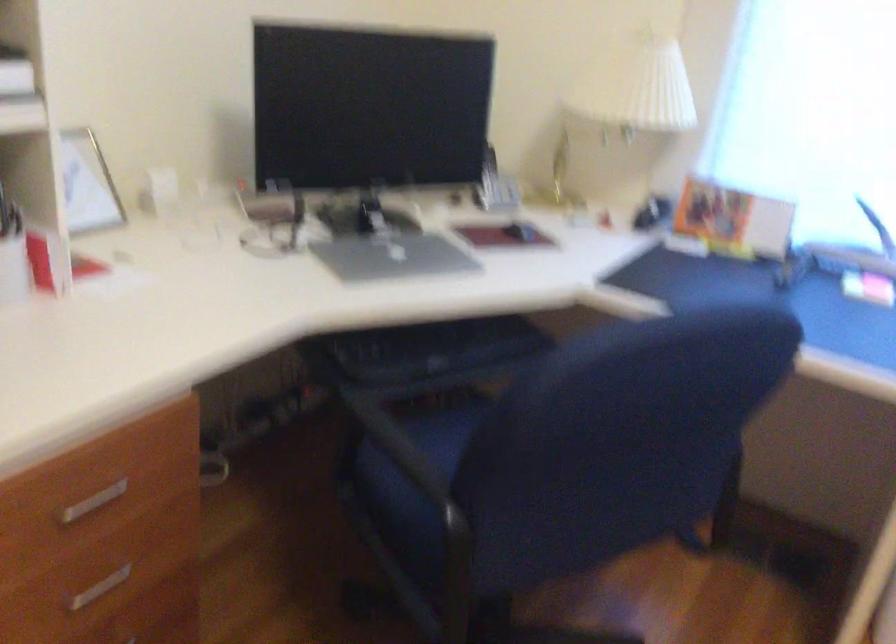
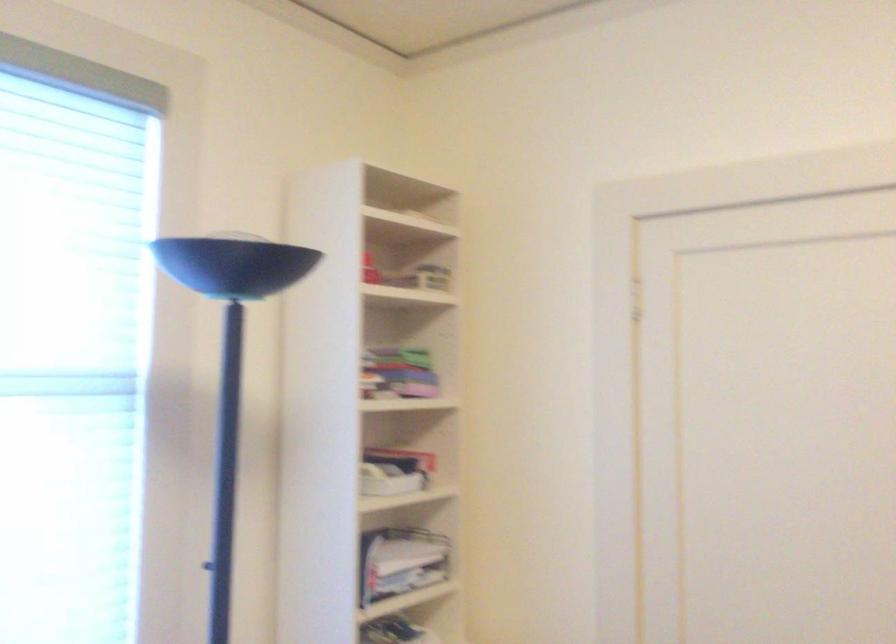
Question: The camera is either moving clockwise (left) or counter-clockwise (right) around the object. The first image is from the beginning of the video and the second image is from the end. Is the camera moving left or right when shooting the video?

Choices:
 (A) Left
 (B) Right

Answer: (A)